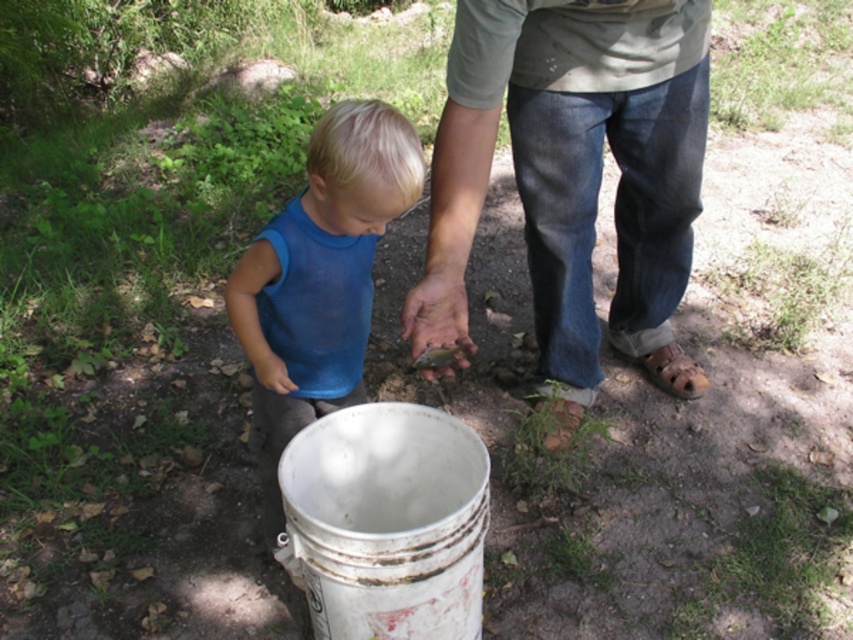
Question: From the image, what is the correct spatial relationship of denim jeans at center in relation to blue mesh shirt at center?

Choices:
 (A) above
 (B) below

Answer: (A)

Question: Which object is closer to the camera taking this photo?

Choices:
 (A) denim jeans at center
 (B) blue mesh shirt at center

Answer: (B)

Question: Does denim jeans at center appear on the right side of blue mesh shirt at center?

Choices:
 (A) yes
 (B) no

Answer: (A)

Question: Can you confirm if denim jeans at center is positioned above blue mesh shirt at center?

Choices:
 (A) no
 (B) yes

Answer: (B)